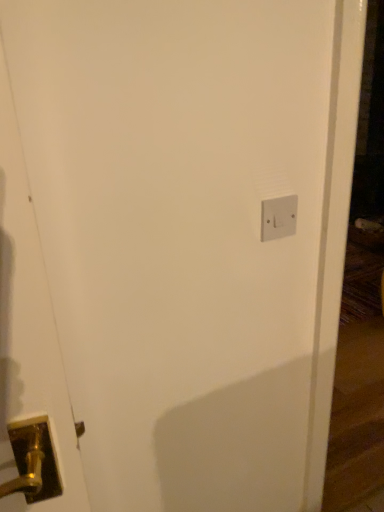
What do you see at coordinates (278, 217) in the screenshot?
I see `white plastic light switch at center` at bounding box center [278, 217].

This screenshot has height=512, width=384. I want to click on white plastic light switch at center, so click(x=278, y=217).

Find the location of `white plastic light switch at center`. white plastic light switch at center is located at coordinates (278, 217).